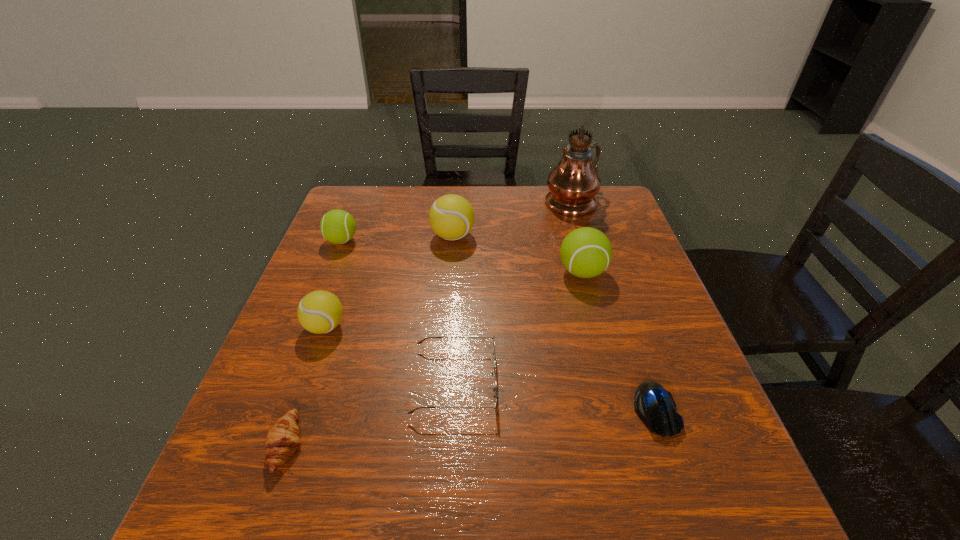
Image resolution: width=960 pixels, height=540 pixels. In order to click on the sixth tallest object in this screenshot , I will do `click(495, 407)`.

Identify the location of green sunglasses. (495, 407).

Locate an element on the screen. This screenshot has height=540, width=960. pastry is located at coordinates (282, 440).

You are a GUI agent. You are given a task and a screenshot of the screen. Output one action in this format:
    pyautogui.click(x=<x>, y=<y>)
    Task: Click on the shortest object
    
    Given the screenshot: What is the action you would take?
    pyautogui.click(x=654, y=405)

At what (x,y) coordinates should I click in order to perform the action: click on free space located on the left of the farthest object. Please return your answer as a coordinate pair (x, y). Looking at the image, I should click on (465, 201).

You are a GUI agent. You are given a task and a screenshot of the screen. Output one action in this format:
    pyautogui.click(x=<x>, y=<y>)
    Task: Click on the vacant space located 0.350m on the right of the right yellow tennis ball
    This screenshot has height=540, width=960.
    Given the screenshot: What is the action you would take?
    (x=604, y=236)

At what (x,y) coordinates should I click in order to perform the action: click on free location located 0.150m on the front of the nearer green tennis ball. Please return your answer as a coordinate pair (x, y). Looking at the image, I should click on (600, 337).

Locate an element on the screen. This screenshot has width=960, height=540. free space located 0.080m on the right of the left green tennis ball is located at coordinates (389, 241).

The height and width of the screenshot is (540, 960). I want to click on free region located on the left of the left yellow tennis ball, so click(281, 327).

The height and width of the screenshot is (540, 960). Identify the location of vacant point located on the front-facing side of the sixth tallest object. (627, 381).